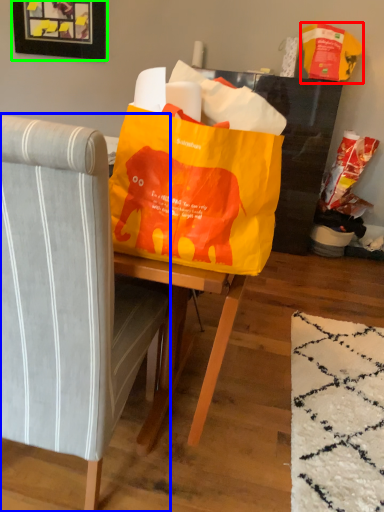
Question: Considering the real-world distances, which object is farthest from grocery bag (highlighted by a red box)? chair (highlighted by a blue box) or picture frame (highlighted by a green box)?

Choices:
 (A) chair
 (B) picture frame

Answer: (A)